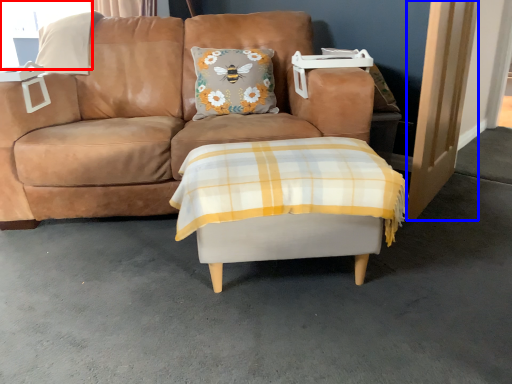
Question: Which of the following is the farthest to the observer, window screen (highlighted by a red box) or door (highlighted by a blue box)?

Choices:
 (A) window screen
 (B) door

Answer: (A)